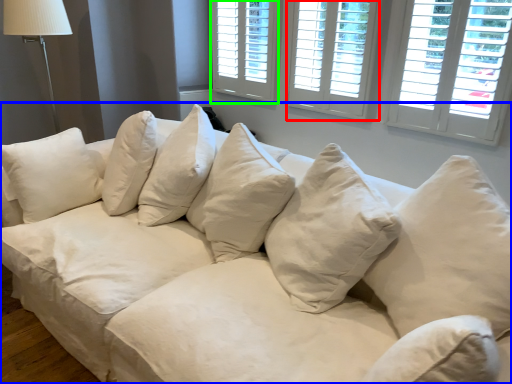
Question: Considering the real-world distances, which object is farthest from window (highlighted by a red box)? studio couch (highlighted by a blue box) or window (highlighted by a green box)?

Choices:
 (A) studio couch
 (B) window

Answer: (A)